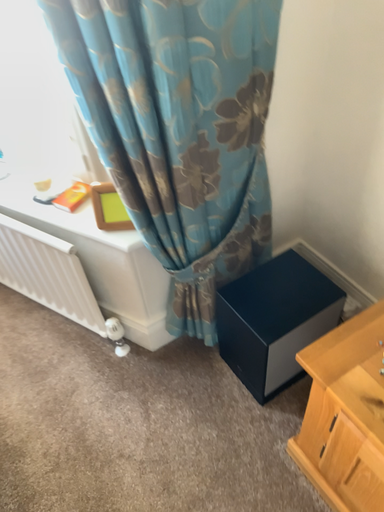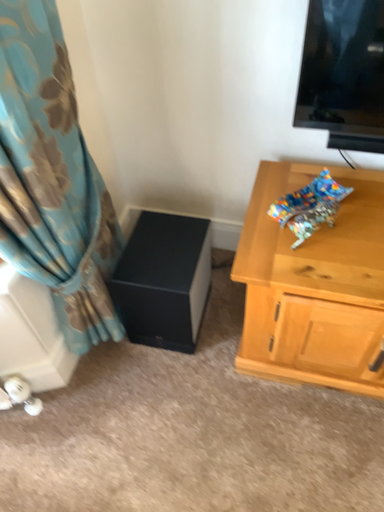
Question: Which way did the camera rotate in the video?

Choices:
 (A) rotated left
 (B) rotated right

Answer: (B)